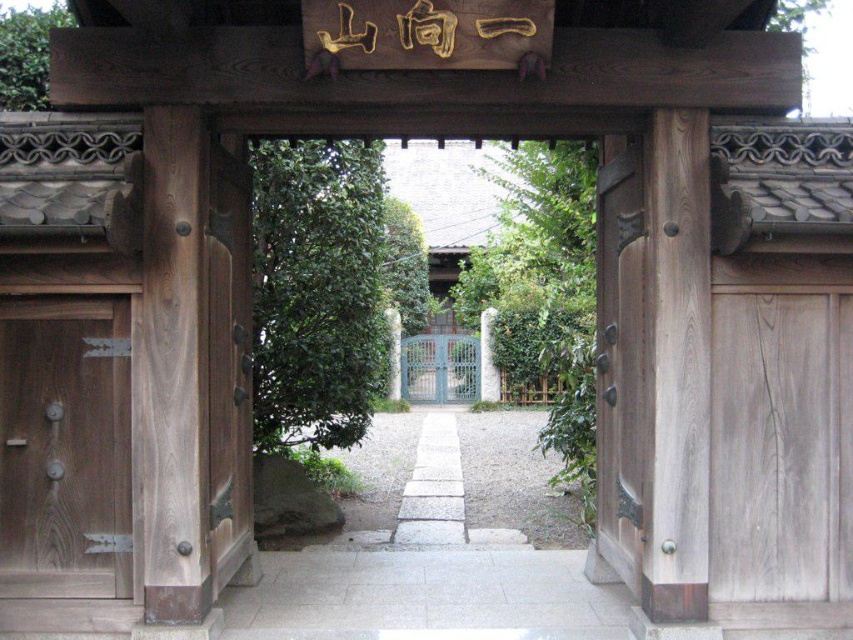
You are standing in front of the traditional Japanese wooden gate and want to take a photo. There are two points marked on the gate at coordinates point (751, 340) and point (19, 461). Which point will appear closer to you in the photo?

Point (751, 340) is further to the camera than point (19, 461), so the point (19, 461) will appear closer to you in the photo.

You are standing at the entrance of the traditional Japanese wooden gate and want to walk towards the gravel area. According to the image, which direction should you move relative to the point marked at coordinate (x=425, y=596)?

The point at coordinate (x=425, y=596) indicates the gray stone path at center. To reach the gravel area, you should move forward along the gray stone path at center as it leads towards the gravel area.

You are a delivery person trying to deliver a package to the address behind the smooth wooden door at right. The delivery requires a ramp with a height of 0.5 meters. Can the gray stone path at center provide a suitable ramp for the delivery?

The gray stone path at center has a lesser height compared to the smooth wooden door at right. Since the ramp requires a height of 0.5 meters and the path is lower, it may not provide sufficient elevation. You might need an additional ramp or adjust the delivery method.